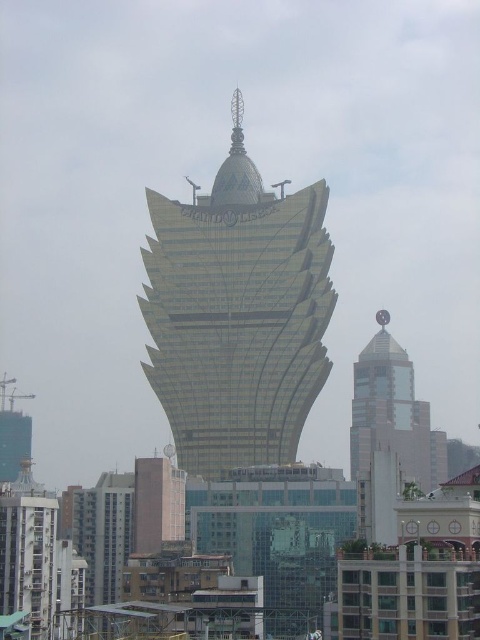
You are an urban planner analyzing the skyline. You observe the gold metallic tower at center and the glassy reflective tower at center. Which of these two towers has a greater width?

The gold metallic tower at center has a greater width than the glassy reflective tower at center according to the description.

You are standing in the city and see the gold metallic tower at center and the glassy reflective tower at center. Which one appears nearer to you?

The gold metallic tower at center appears nearer to you because it is closer to the viewer than the glassy reflective tower at center.

You are standing in front of the skyscraper and want to take a photo. There are two points marked on the building. One is at coordinate point [155,308] and the other is at point [381,428]. Which point will appear larger in your photo?

Point [155,308] will appear larger in the photo because it is closer to the camera than point [381,428].